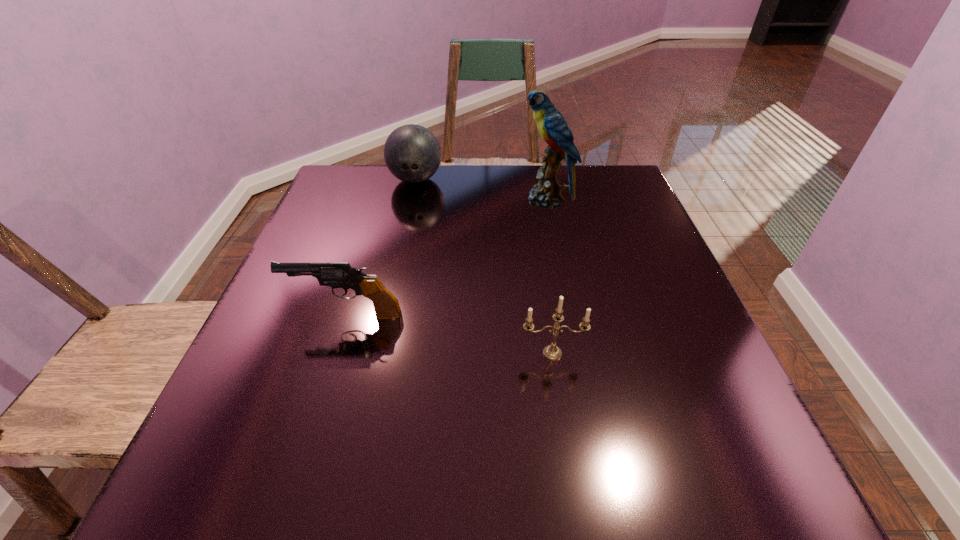
Image resolution: width=960 pixels, height=540 pixels. I want to click on bowling ball located at the far edge, so pyautogui.click(x=412, y=153).

What are the coordinates of `bowling ball present at the left edge` in the screenshot? It's located at (412, 153).

Identify the location of gun located at the left edge. This screenshot has width=960, height=540. (334, 274).

Identify the location of object that is positioned at the far left corner. The width and height of the screenshot is (960, 540). (412, 153).

Where is `vacant space at the far edge of the desktop`? The width and height of the screenshot is (960, 540). vacant space at the far edge of the desktop is located at coordinates (393, 180).

The height and width of the screenshot is (540, 960). What are the coordinates of `vacant space at the left edge of the desktop` in the screenshot? It's located at (316, 421).

At what (x,y) coordinates should I click in order to perform the action: click on free space at the right edge of the desktop. Please return your answer as a coordinate pair (x, y). The height and width of the screenshot is (540, 960). Looking at the image, I should click on (700, 320).

Find the location of `vacant space at the near left corner of the desktop`. vacant space at the near left corner of the desktop is located at coordinates (235, 468).

Locate an element on the screen. This screenshot has width=960, height=540. vacant space at the near right corner of the desktop is located at coordinates (762, 487).

This screenshot has height=540, width=960. Identify the location of vacant region between the gun and the bowling ball. (381, 247).